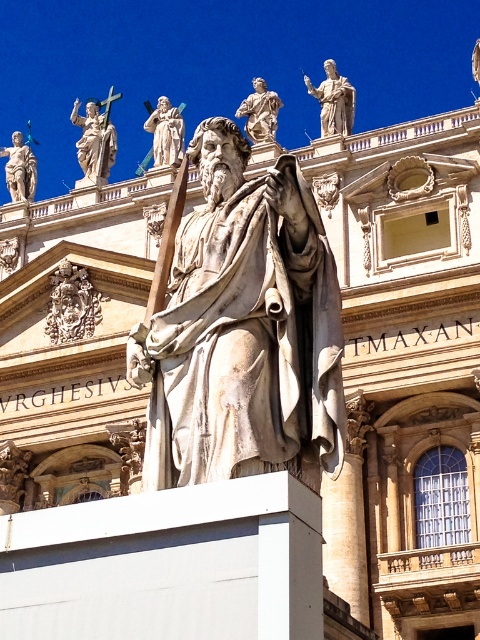
Looking at this image, you are an architect reviewing the layout of the building. You need to determine the spatial relationship between the white marble statue at center and the white marble statue at upper center. Which statue is located to the left of the other?

The white marble statue at center is positioned on the left side of white marble statue at upper center, meaning the white marble statue at center is to the left of the white marble statue at upper center.

You are an art conservator assessing the facade of the building. You notice the carved stone relief at upper left and the polished bronze statue at upper center. Which of these two objects has a smaller width?

The carved stone relief at upper left has a smaller width than the polished bronze statue at upper center.